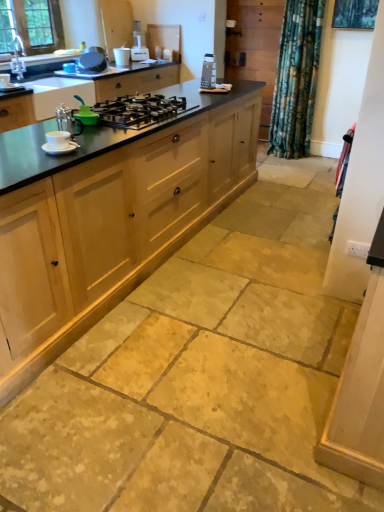
Where is `vacant area that lies in front of white glossy screen door at right`? vacant area that lies in front of white glossy screen door at right is located at coordinates (339, 313).